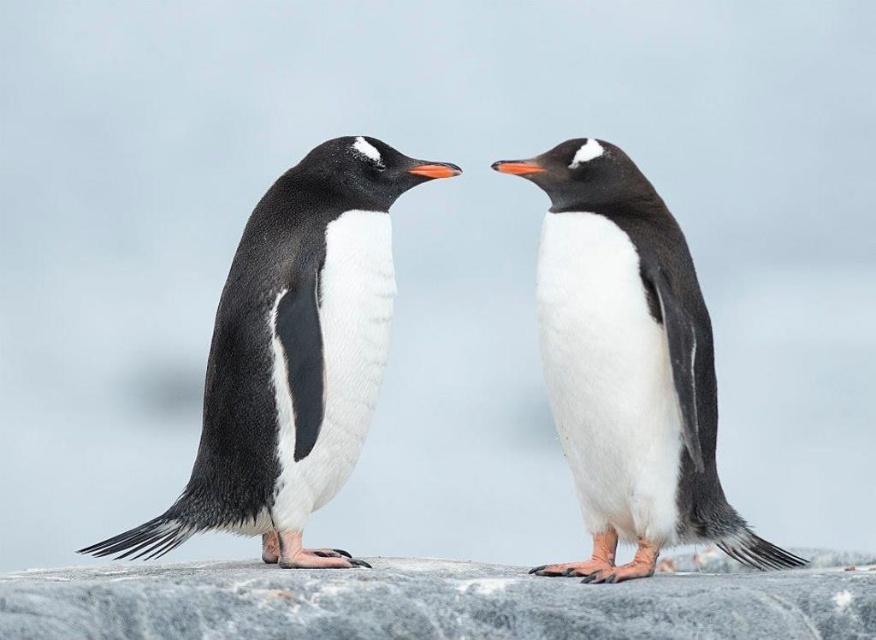
You are a photographer trying to capture the black glossy penguin at left and the gray granite rock at center in the same frame. Based on their positions, which object is closer to the left edge of the photo?

The black glossy penguin at left is closer to the left edge of the photo because it is positioned on the left side of the gray granite rock at center.

You are a photographer trying to capture a photo of both the white matte penguin at center and the gray granite rock at center. Since you want them both in focus, you need to know their positions relative to each other. Which object is positioned to the right side of the other?

The white matte penguin at center is to the right of gray granite rock at center.